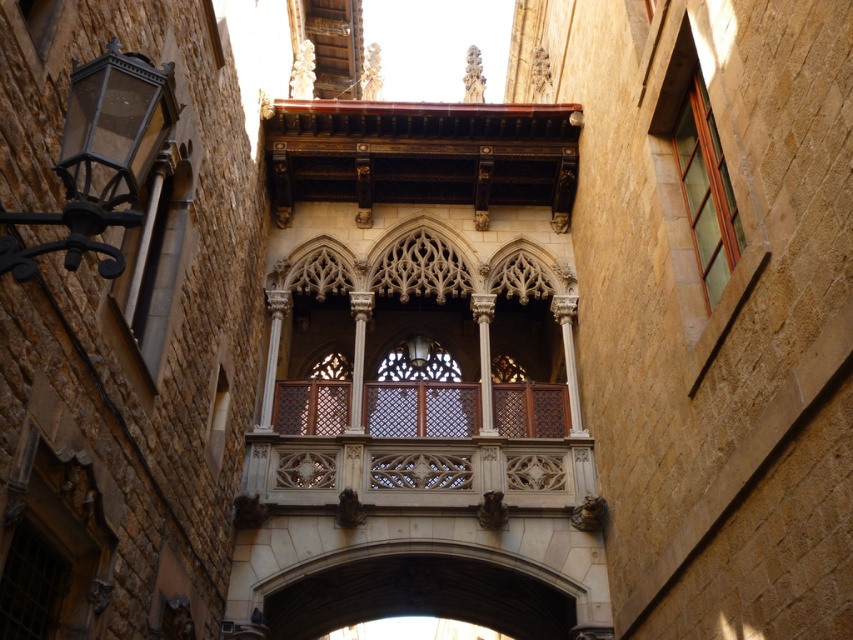
You are standing in the narrow alleyway between the two historic stone buildings. You notice two points marked in the scene. The first point is at coordinates point (404, 225) and the second at point (714, 294). From your perspective, which point is closer to you?

Point (714, 294) is closer to you because the description states that point (404, 225) is behind point (714, 294).